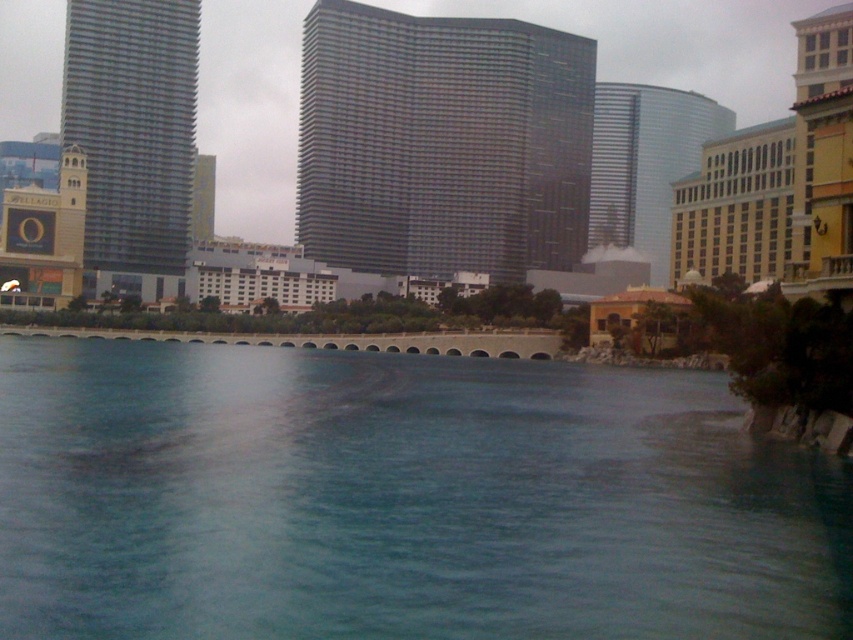
Is blue glassy water at center thinner than glassy metallic skyscraper at center?

Yes.

The width and height of the screenshot is (853, 640). Describe the element at coordinates (399, 500) in the screenshot. I see `blue glassy water at center` at that location.

Is point (410, 524) positioned in front of point (302, 154)?

Yes, it is in front of point (302, 154).

Locate an element on the screen. The width and height of the screenshot is (853, 640). blue glassy water at center is located at coordinates (399, 500).

Describe the element at coordinates (643, 163) in the screenshot. This screenshot has width=853, height=640. I see `glassy reflective skyscraper at center` at that location.

Is glassy reflective skyscraper at center further to the viewer compared to gold/brick hotel at right?

Yes.

Locate an element on the screen. The height and width of the screenshot is (640, 853). glassy reflective skyscraper at center is located at coordinates (643, 163).

Where is `glassy reflective skyscraper at center`? glassy reflective skyscraper at center is located at coordinates (643, 163).

How far apart are glassy metallic skyscraper at center and glassy reflective skyscraper at center?

A distance of 120.99 feet exists between glassy metallic skyscraper at center and glassy reflective skyscraper at center.

In the scene shown: Who is taller, glassy metallic skyscraper at center or glassy reflective skyscraper at center?

Standing taller between the two is glassy metallic skyscraper at center.

Locate an element on the screen. glassy metallic skyscraper at center is located at coordinates (442, 141).